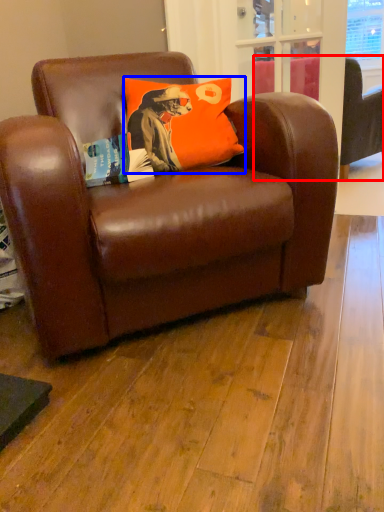
Question: Which of the following is the farthest to the observer, studio couch (highlighted by a red box) or pillow (highlighted by a blue box)?

Choices:
 (A) studio couch
 (B) pillow

Answer: (A)